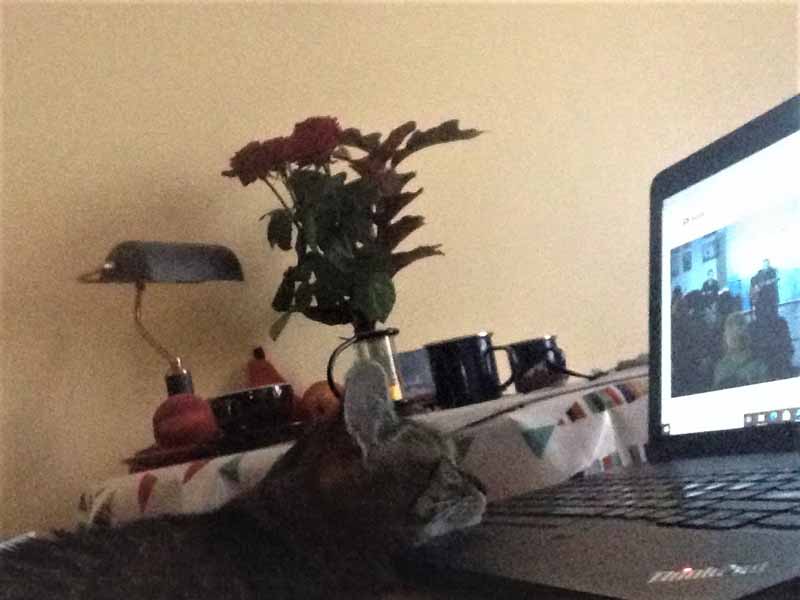
At what (x,y) coordinates should I click in order to perform the action: click on coffee cups. Please return your answer as a coordinate pair (x, y). This screenshot has width=800, height=600. Looking at the image, I should click on (478, 367), (536, 367), (262, 406).